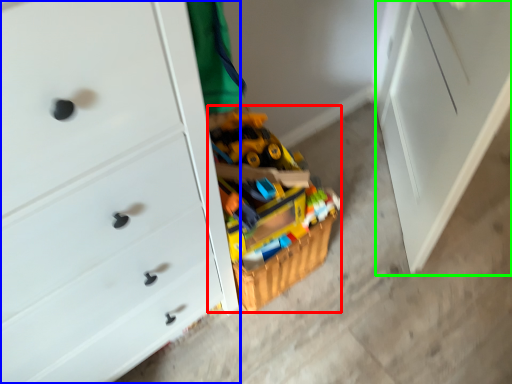
Question: Which object is positioned closest to toy (highlighted by a red box)? Select from chest of drawers (highlighted by a blue box) and file cabinet (highlighted by a green box).

Choices:
 (A) chest of drawers
 (B) file cabinet

Answer: (A)